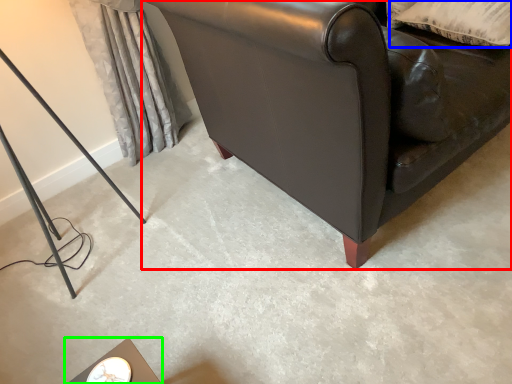
Question: Which object is positioned farthest from studio couch (highlighted by a red box)? Select from pillow (highlighted by a blue box) and table (highlighted by a green box).

Choices:
 (A) pillow
 (B) table

Answer: (B)